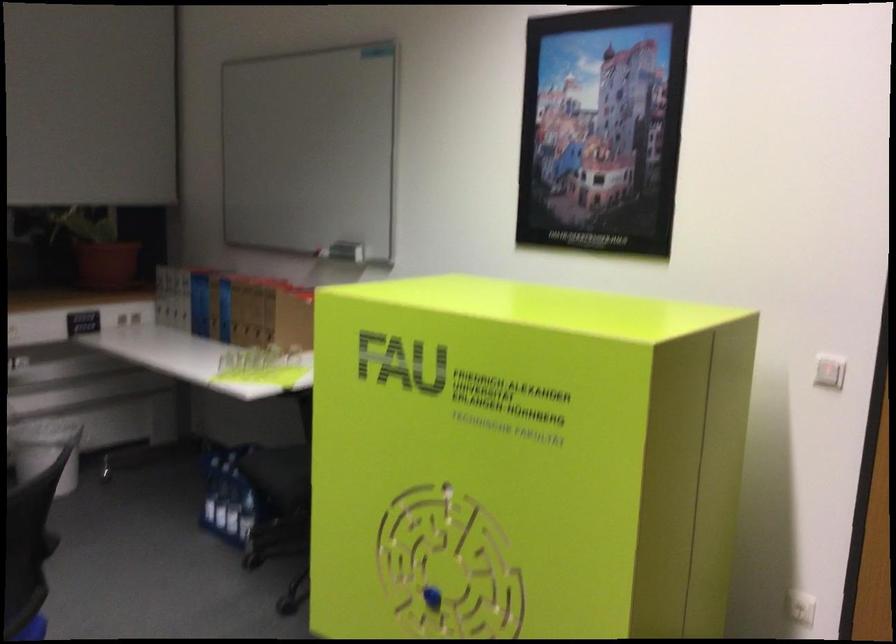
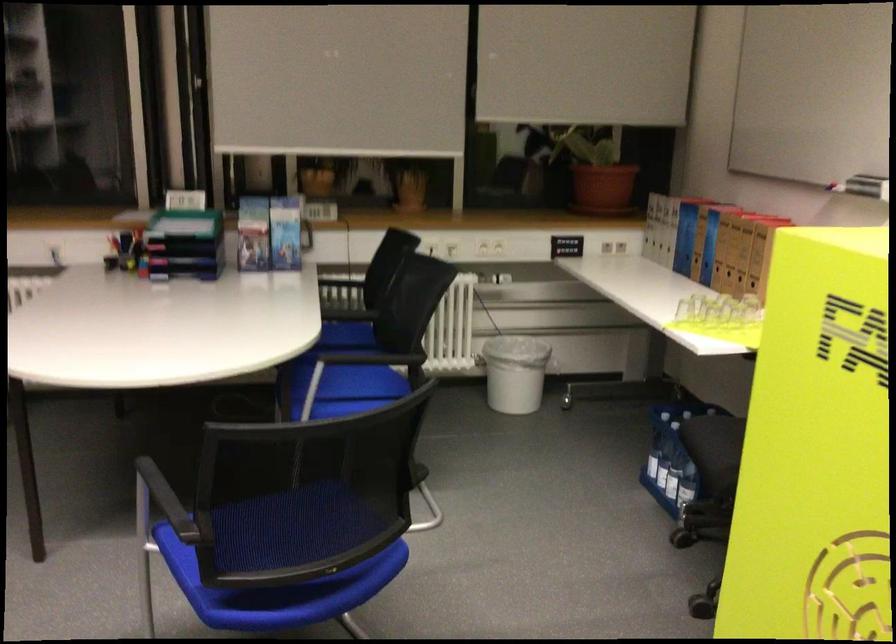
Find the pixel in the second image that matches (x=247, y=314) in the first image.

(730, 251)